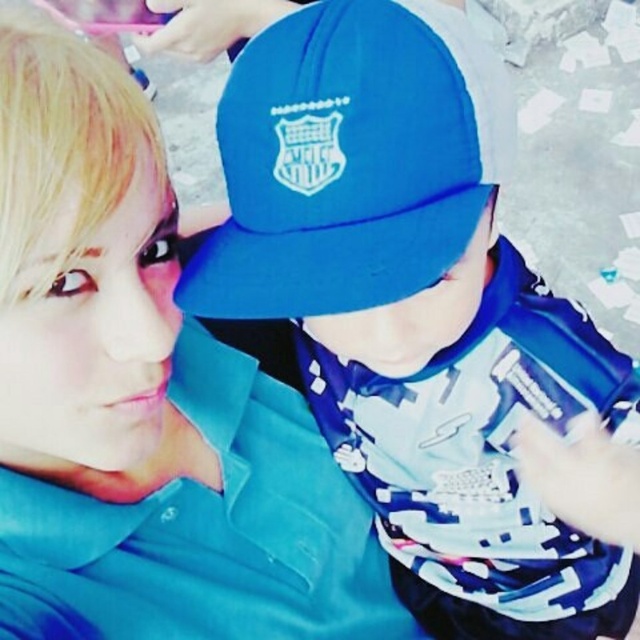
Question: Is matte blue cap at center thinner than blue matte baseball cap at center?

Choices:
 (A) yes
 (B) no

Answer: (B)

Question: Which point is farther from the camera taking this photo?

Choices:
 (A) (316, 124)
 (B) (301, 134)

Answer: (B)

Question: Can you confirm if matte blue cap at center is positioned to the left of blue matte baseball cap at center?

Choices:
 (A) yes
 (B) no

Answer: (B)

Question: Which object appears closest to the camera in this image?

Choices:
 (A) matte blue cap at center
 (B) blue matte baseball cap at center

Answer: (B)

Question: In this image, where is matte blue cap at center located relative to blue matte baseball cap at center?

Choices:
 (A) above
 (B) below

Answer: (B)